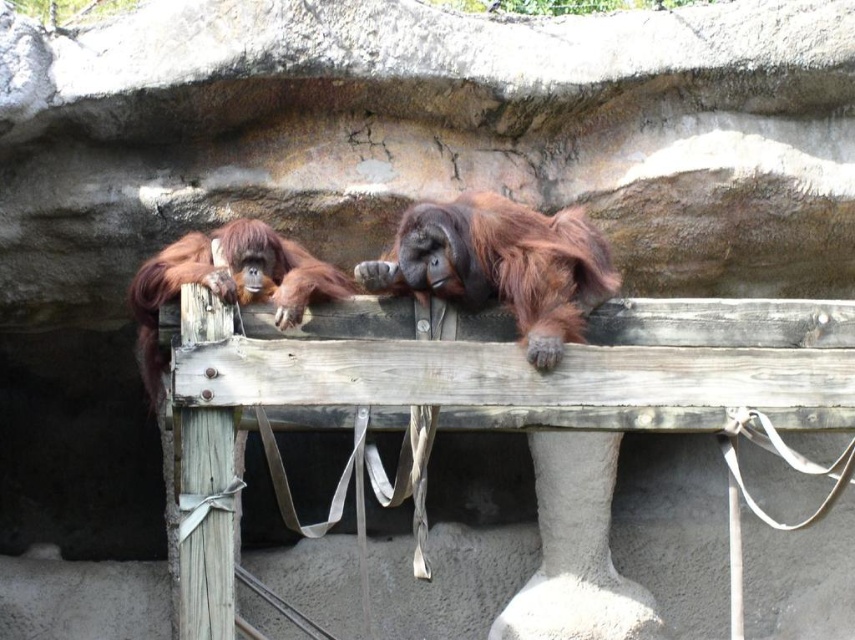
Question: Among these points, which one is nearest to the camera?

Choices:
 (A) (600, 252)
 (B) (226, 234)

Answer: (B)

Question: Which point is closer to the camera?

Choices:
 (A) (x=160, y=387)
 (B) (x=537, y=280)

Answer: (B)

Question: Is orange fur orangutan at center smaller than orange fur orangutan at left?

Choices:
 (A) yes
 (B) no

Answer: (A)

Question: From the image, what is the correct spatial relationship of orange fur orangutan at center in relation to orange fur orangutan at left?

Choices:
 (A) left
 (B) right

Answer: (B)

Question: Which point is farther to the camera?

Choices:
 (A) orange fur orangutan at left
 (B) orange fur orangutan at center

Answer: (B)

Question: Does orange fur orangutan at center have a lesser width compared to orange fur orangutan at left?

Choices:
 (A) yes
 (B) no

Answer: (A)